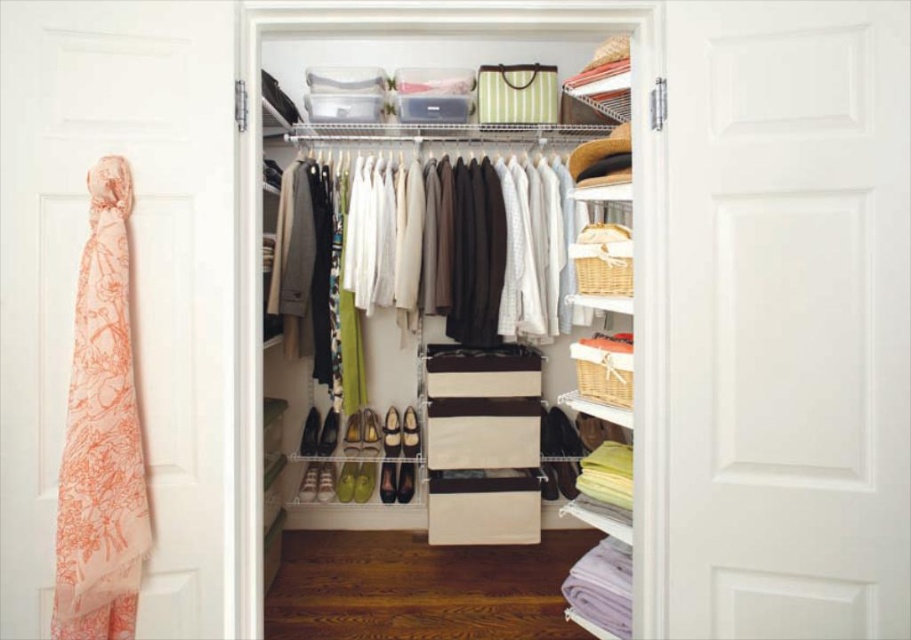
Question: Which of the following is the closest to the observer?

Choices:
 (A) (781, 372)
 (B) (654, 429)
 (C) (118, 604)

Answer: (A)

Question: Is peach silk scarf at left thinner than matte white closet at center?

Choices:
 (A) no
 (B) yes

Answer: (B)

Question: Is matte white closet at center bigger than peach floral scarf at left?

Choices:
 (A) yes
 (B) no

Answer: (A)

Question: Which point appears closest to the camera in this image?

Choices:
 (A) (254, 161)
 (B) (107, 620)
 (C) (865, 381)

Answer: (C)

Question: Which object appears farthest from the camera in this image?

Choices:
 (A) peach floral scarf at left
 (B) peach silk scarf at left
 (C) matte white closet at center

Answer: (C)

Question: Does peach silk scarf at left appear over peach floral scarf at left?

Choices:
 (A) no
 (B) yes

Answer: (B)